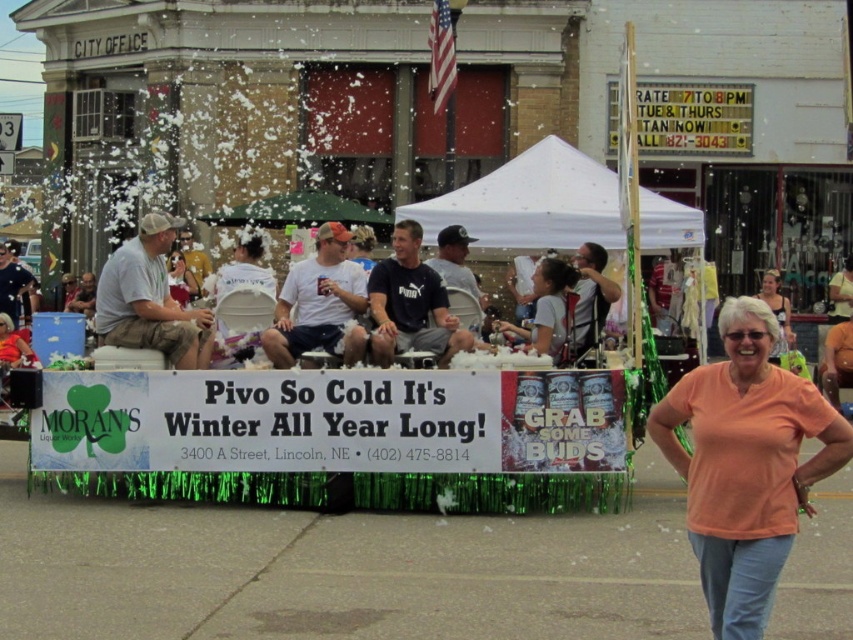
Question: Is white fabric canopy at center above matte orange shirt at center?

Choices:
 (A) no
 (B) yes

Answer: (B)

Question: Does light brown cotton shirt at left have a lesser width compared to light gray t-shirt at center?

Choices:
 (A) yes
 (B) no

Answer: (A)

Question: Which of the following is the closest to the observer?

Choices:
 (A) (146, 307)
 (B) (767, 276)
 (C) (553, 344)

Answer: (A)

Question: Estimate the real-world distances between objects in this image. Which object is farther from the orange cotton shirt at lower right?

Choices:
 (A) light brown cotton shirt at left
 (B) matte orange shirt at center

Answer: (B)

Question: Which of the following is the farthest from the observer?

Choices:
 (A) matte pink dress at center
 (B) white fabric canopy at center
 (C) matte orange shirt at center

Answer: (A)

Question: Is light gray t-shirt at center below matte orange shirt at center?

Choices:
 (A) yes
 (B) no

Answer: (B)